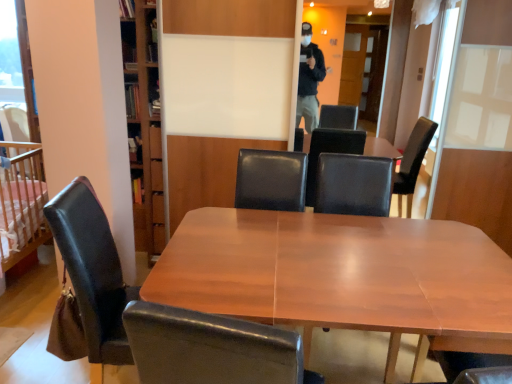
Question: Are black leather armchair at center and leather at left, marked as the second chair in a left-to-right arrangement, beside each other?

Choices:
 (A) yes
 (B) no

Answer: (B)

Question: Is black leather armchair at center not within leather at left, the 2th chair from the back?

Choices:
 (A) yes
 (B) no

Answer: (A)

Question: Can leather at left, the 1th chair when ordered from right to left, be found inside black leather armchair at center?

Choices:
 (A) no
 (B) yes

Answer: (A)

Question: Is black leather armchair at center thinner than leather at left, marked as the second chair in a left-to-right arrangement?

Choices:
 (A) no
 (B) yes

Answer: (B)

Question: Is black leather armchair at center further to the viewer compared to leather at left, marked as the second chair in a left-to-right arrangement?

Choices:
 (A) no
 (B) yes

Answer: (B)

Question: From the image's perspective, is black leather armchair at center positioned above or below wooden crib at left?

Choices:
 (A) below
 (B) above

Answer: (B)

Question: Is point (382, 203) closer or farther from the camera than point (15, 157)?

Choices:
 (A) farther
 (B) closer

Answer: (B)

Question: From a real-world perspective, is black leather armchair at center positioned above or below wooden crib at left?

Choices:
 (A) above
 (B) below

Answer: (A)

Question: Is black leather armchair at center taller or shorter than wooden crib at left?

Choices:
 (A) tall
 (B) short

Answer: (B)

Question: Is wooden crib at left taller or shorter than wooden table at center?

Choices:
 (A) short
 (B) tall

Answer: (B)

Question: Considering the relative positions of wooden crib at left and wooden table at center in the image provided, is wooden crib at left to the left or to the right of wooden table at center?

Choices:
 (A) left
 (B) right

Answer: (A)

Question: Is wooden crib at left situated inside wooden table at center or outside?

Choices:
 (A) outside
 (B) inside

Answer: (A)

Question: From a real-world perspective, is wooden crib at left positioned above or below wooden table at center?

Choices:
 (A) above
 (B) below

Answer: (A)

Question: In terms of size, does black leather chair at left, which is the 2th chair from front to back, appear bigger or smaller than leather at left, marked as the second chair in a left-to-right arrangement?

Choices:
 (A) big
 (B) small

Answer: (B)

Question: Considering the positions of black leather chair at left, positioned as the first chair in back-to-front order, and leather at left, which is counted as the first chair, starting from the front, in the image, is black leather chair at left, positioned as the first chair in back-to-front order, wider or thinner than leather at left, which is counted as the first chair, starting from the front,?

Choices:
 (A) wide
 (B) thin

Answer: (B)